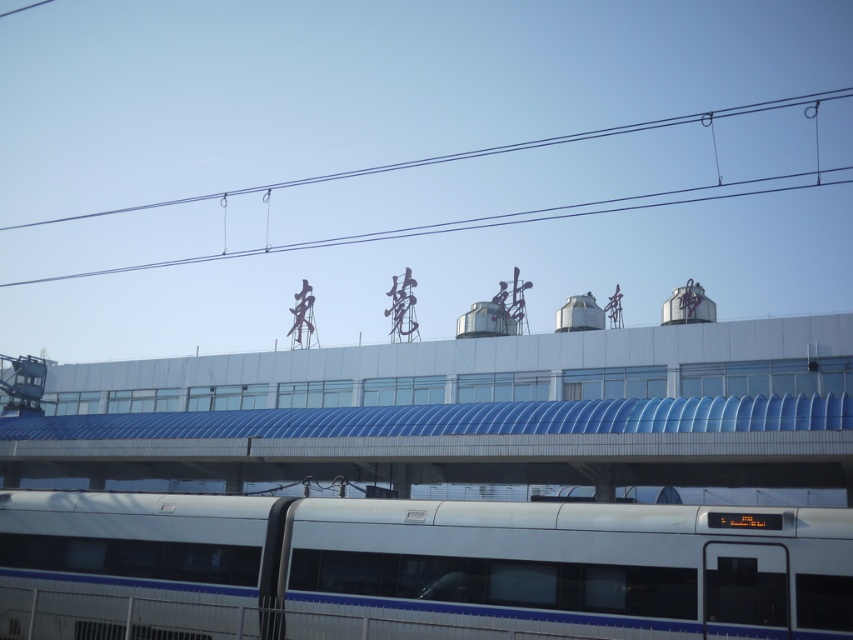
Does white glossy passenger train at bottom have a greater height compared to black wire at upper center?

In fact, white glossy passenger train at bottom may be shorter than black wire at upper center.

Between point (556, 621) and point (219, 195), which one is positioned in front?

Point (556, 621)

Is point (315, 605) positioned behind point (822, 179)?

No, it is in front of (822, 179).

This screenshot has width=853, height=640. I want to click on white glossy passenger train at bottom, so click(x=415, y=568).